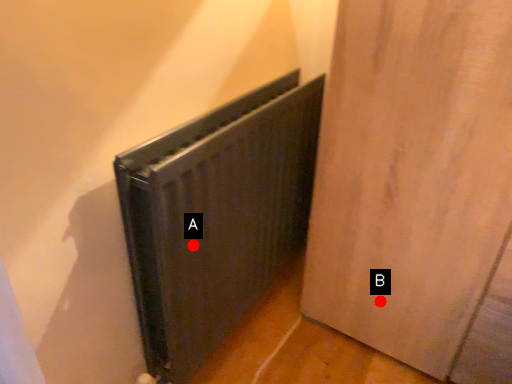
Question: Two points are circled on the image, labeled by A and B beside each circle. Which of the following is the farthest from the observer?

Choices:
 (A) A is further
 (B) B is further

Answer: (B)